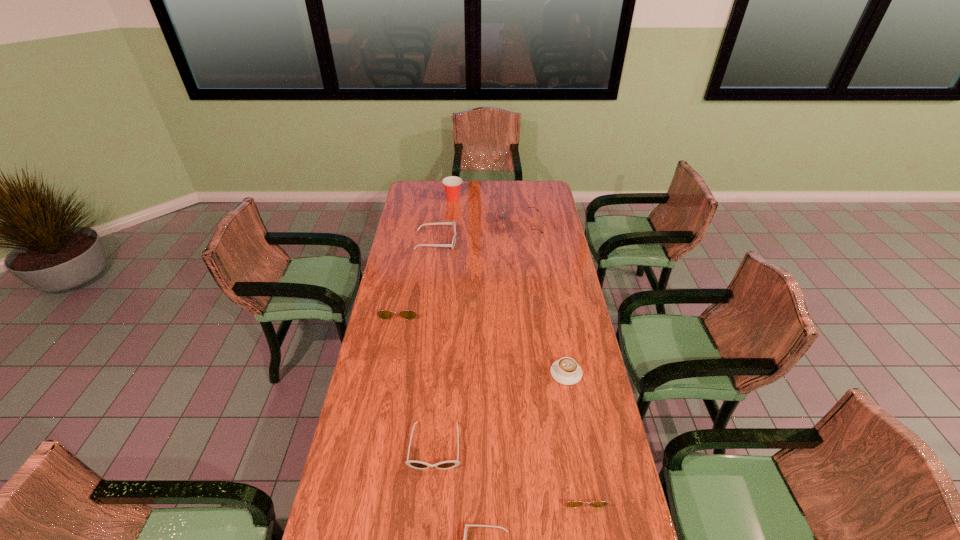
The height and width of the screenshot is (540, 960). I want to click on cup, so click(452, 184).

You are a GUI agent. You are given a task and a screenshot of the screen. Output one action in this format:
    pyautogui.click(x=<x>, y=<y>)
    Task: Click on the red cup
    
    Given the screenshot: What is the action you would take?
    pyautogui.click(x=452, y=184)

Where is `the biggest green sunglasses`? the biggest green sunglasses is located at coordinates (503, 217).

In order to click on the farthest black sunglasses in this screenshot , I will do `click(452, 245)`.

Where is `the leftmost green sunglasses`? The width and height of the screenshot is (960, 540). the leftmost green sunglasses is located at coordinates (382, 314).

I want to click on the second farthest green sunglasses, so (x=382, y=314).

I want to click on the second farthest black sunglasses, so click(444, 465).

Locate an element on the screen. The height and width of the screenshot is (540, 960). cappuccino is located at coordinates (566, 371).

I want to click on the smallest green sunglasses, so click(x=570, y=504).

What are the coordinates of `free space located 0.160m on the back of the farthest object` in the screenshot? It's located at (455, 180).